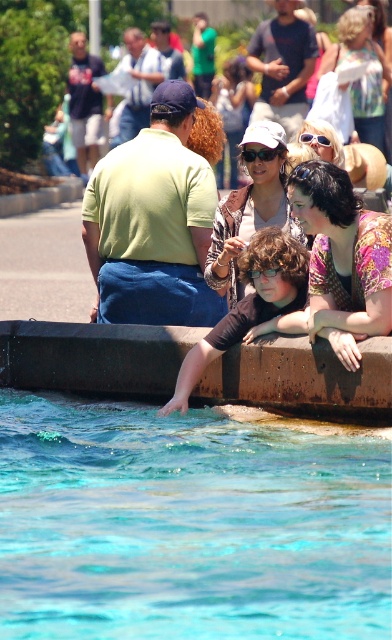
You are a photographer trying to capture the scene from the current angle. You notice the green matte shirt at upper left and the blue plastic sunglasses at upper center. Which object should you focus on first if you want to ensure both are in focus without adjusting the camera settings?

The green matte shirt at upper left is closer to the viewer than the blue plastic sunglasses at upper center. To keep both in focus, focus on the green matte shirt at upper left first since it is closer, and the depth of field may naturally include the farther object.